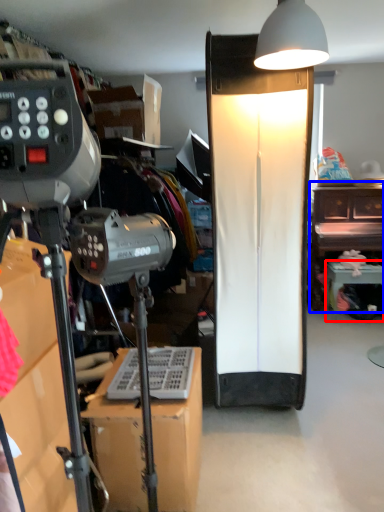
Question: Which object appears closest to the camera in this image, furniture (highlighted by a red box) or furniture (highlighted by a blue box)?

Choices:
 (A) furniture
 (B) furniture

Answer: (A)